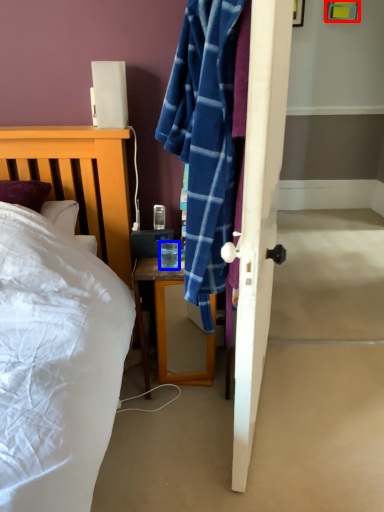
Question: Among these objects, which one is nearest to the camera, picture frame (highlighted by a red box) or coffee cup (highlighted by a blue box)?

Choices:
 (A) picture frame
 (B) coffee cup

Answer: (B)